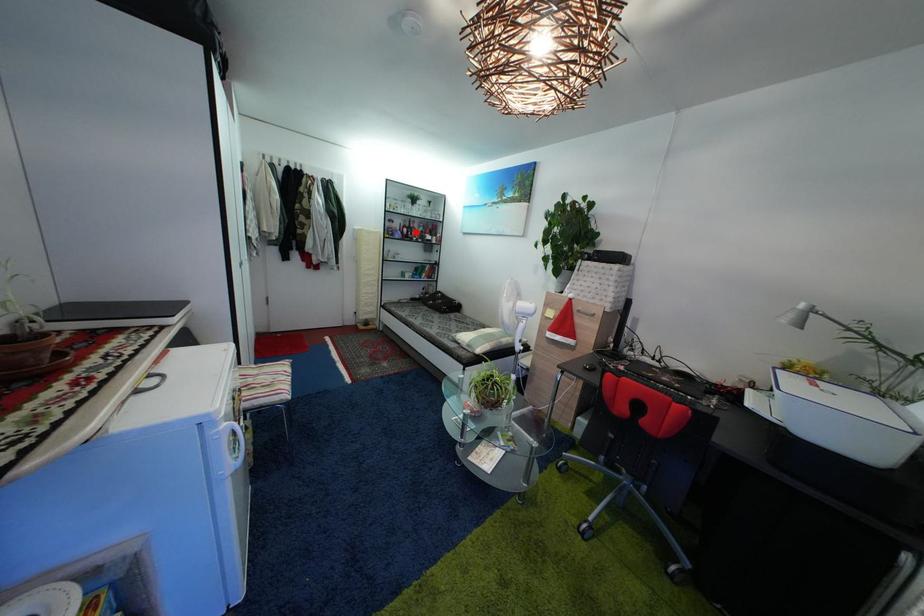
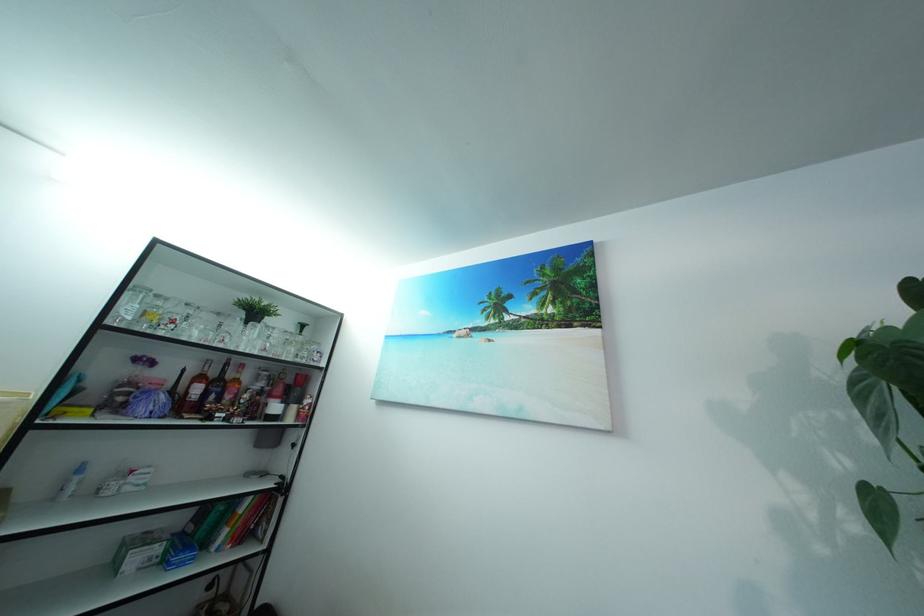
Question: I am providing you with two images of the same scene from different viewpoints. In image1, a red point is highlighted. Considering the same 3D point in image2, which of the following is correct?

Choices:
 (A) It is closer
 (B) It is farther

Answer: (B)